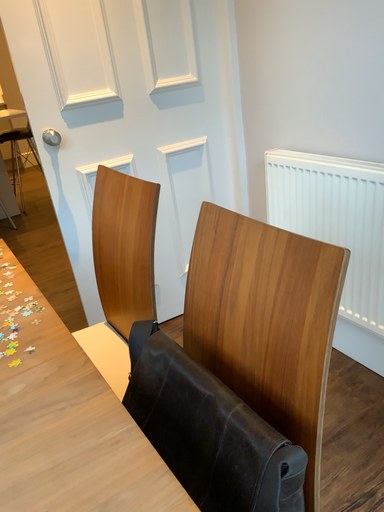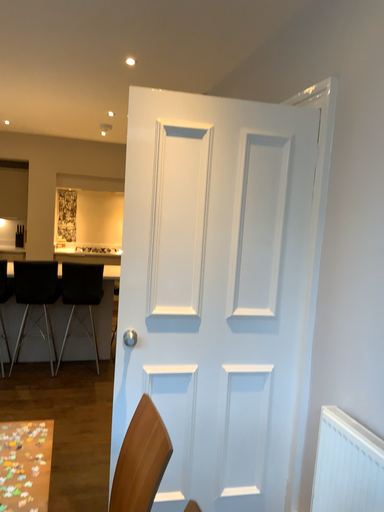
Question: Which way did the camera rotate in the video?

Choices:
 (A) rotated right
 (B) rotated left

Answer: (B)